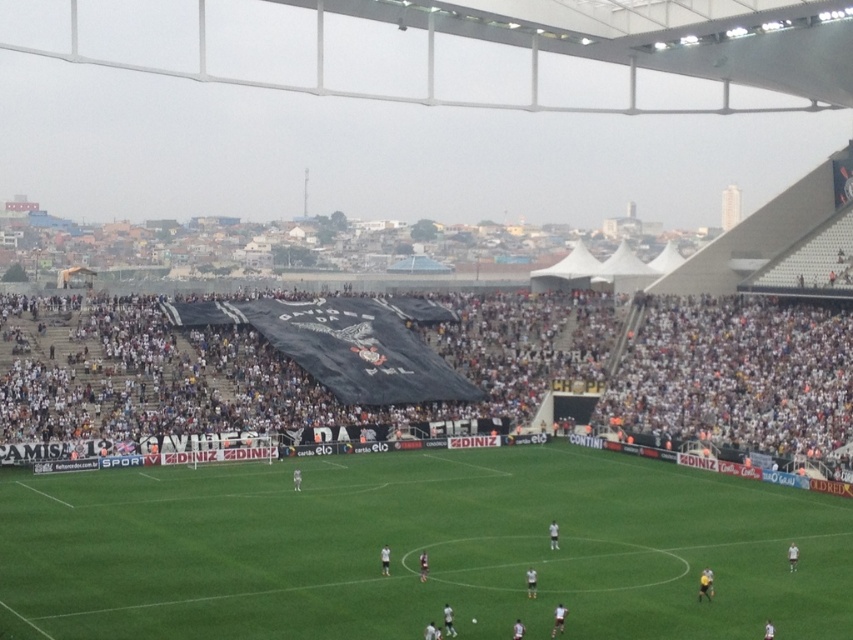
You are a photographer trying to capture the entire scene of the soccer match. You notice the green grass football field at center and the black fabric banner at center. Which object takes up more area in the image?

The black fabric banner at center occupies more space than the green grass football field at center in the image.

You are a photographer at the soccer match and want to capture the entire green grass football field at center and the black fabric banner at center in a single shot. Based on their positions, which one should you focus on first to ensure both are in frame?

The green grass football field at center is located below the black fabric banner at center, so you should focus on the black fabric banner at center first to ensure both are in frame.

You are a photographer standing at the edge of the soccer field. You want to take a photo that includes both the point at coordinates point (830,508) and the point at coordinates point (154,353). Which point should you focus on first to ensure both are in the frame?

You should focus on point (830,508) first because it is closer to you than point (154,353), ensuring both points are within the frame.